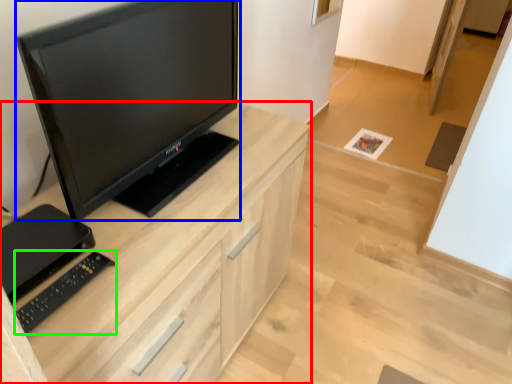
Question: Based on their relative distances, which object is nearer to cabinetry (highlighted by a red box)? Choose from television (highlighted by a blue box) and equipment (highlighted by a green box).

Choices:
 (A) television
 (B) equipment

Answer: (A)